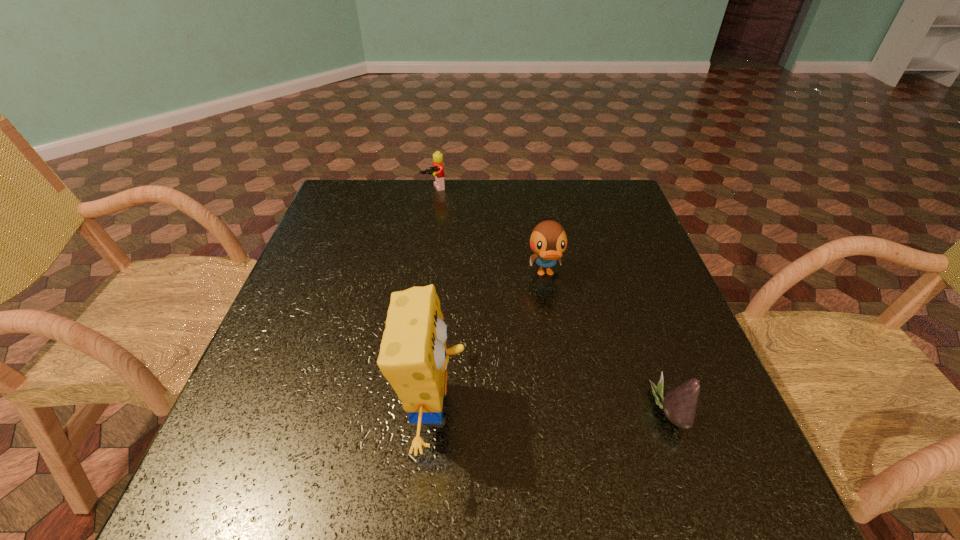
This screenshot has width=960, height=540. Identify the location of free space on the desktop that is between the tallest object and the avocado and is positioned on the front-facing side of the third nearest object. (574, 410).

Locate an element on the screen. The image size is (960, 540). free space on the desktop that is between the tallest object and the avocado and is positioned in front of the farthest object with the accessory visible is located at coordinates (565, 410).